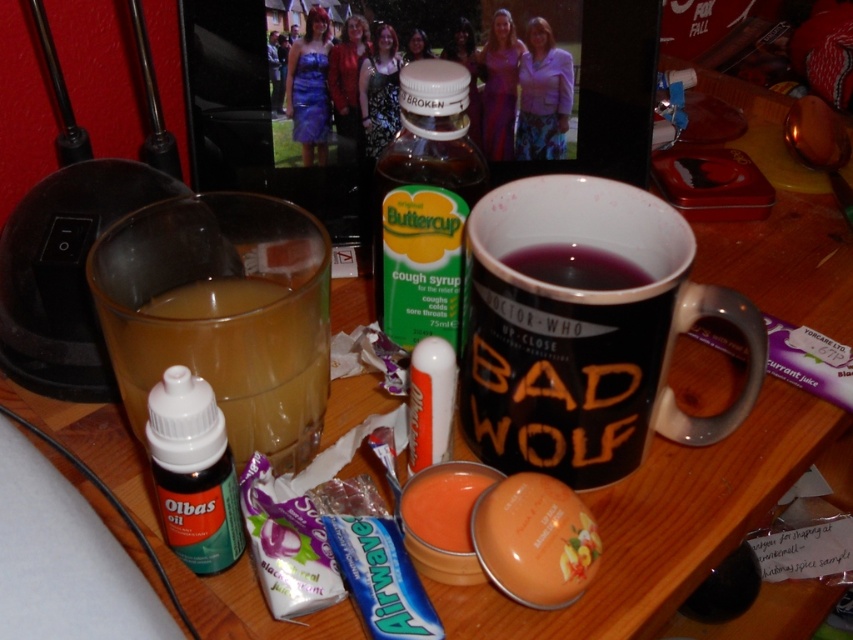
You are organizing items on a desk and need to stack the translucent glass at left and the smooth orange lip balm at center vertically. Which item should you place at the bottom to prevent it from tipping over?

You should place the translucent glass at left at the bottom because it has a greater height than the smooth orange lip balm at center, making it more stable as a base.

You are organizing items on a desk and need to place a new item between the translucent glass at left and the smooth orange lip balm at center. Based on their positions, where should you position the new item?

The translucent glass at left is in front of the smooth orange lip balm at center, so you should place the new item behind the translucent glass at left but in front of the smooth orange lip balm at center to maintain their spatial relationship.

You are organizing items on a desk and need to place the green plastic bottle at center and the matte orange lip balm at center into a drawer. The drawer has a height limit of 10 cm. Can both items fit vertically without exceeding the height limit?

The green plastic bottle at center is much taller than the matte orange lip balm at center. Since the bottle is taller, it might exceed the 10 cm height limit, so only the matte orange lip balm at center can fit vertically in the drawer.